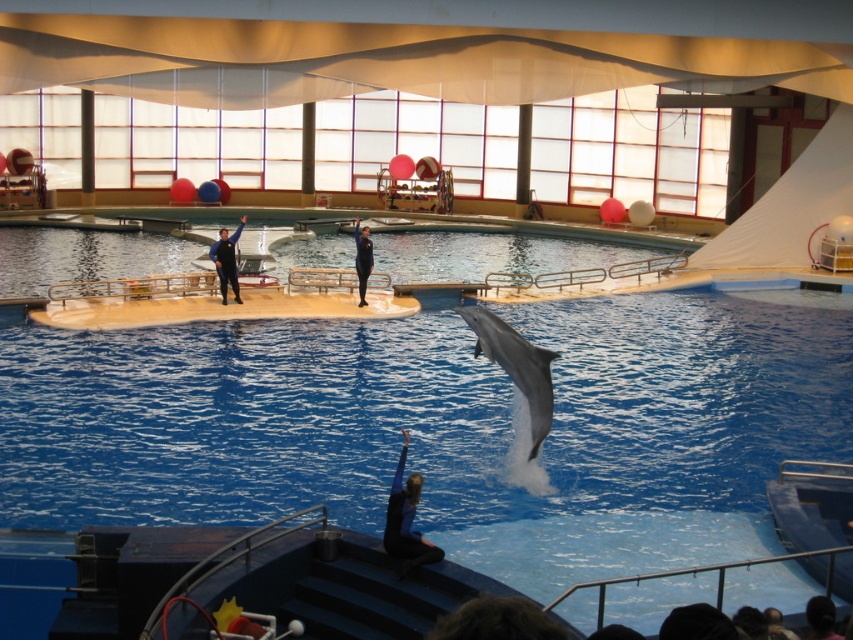
You are a dolphin trainer at the show. You need to place a new buoy at the point marked as point (225, 260). Where exactly should you place the buoy?

The buoy should be placed on the black wetsuit at upper center where point (225, 260) is located.

You are a photographer trying to capture the dolphin midair. You see two trainers wearing black wetsuits in the scene. Which trainer, the one in the black wetsuit at upper center or the black rubber wetsuit at center, is standing to the left of the other?

The black wetsuit at upper center is positioned on the left side of black rubber wetsuit at center.